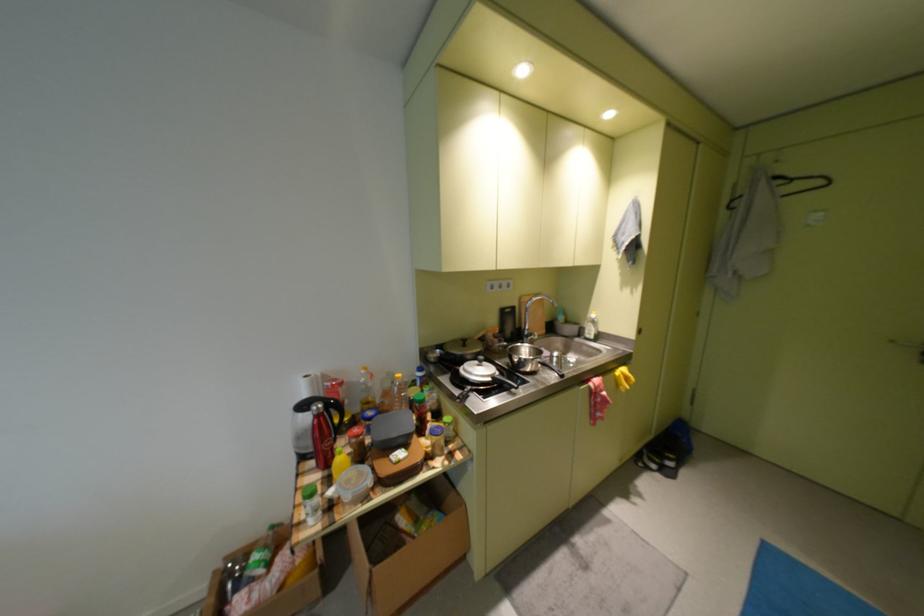
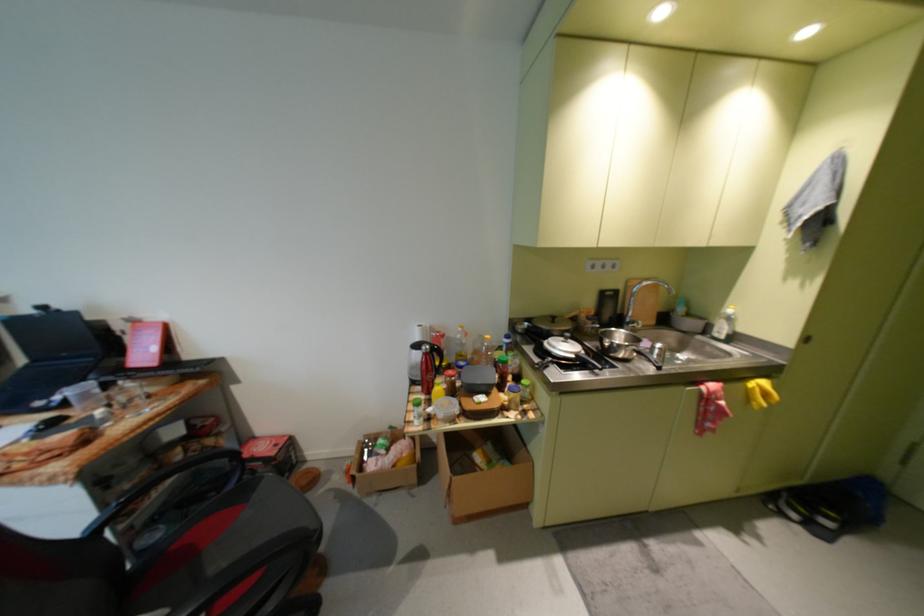
The point at [333,419] is marked in the first image. Where is the corresponding point in the second image?

(439, 358)